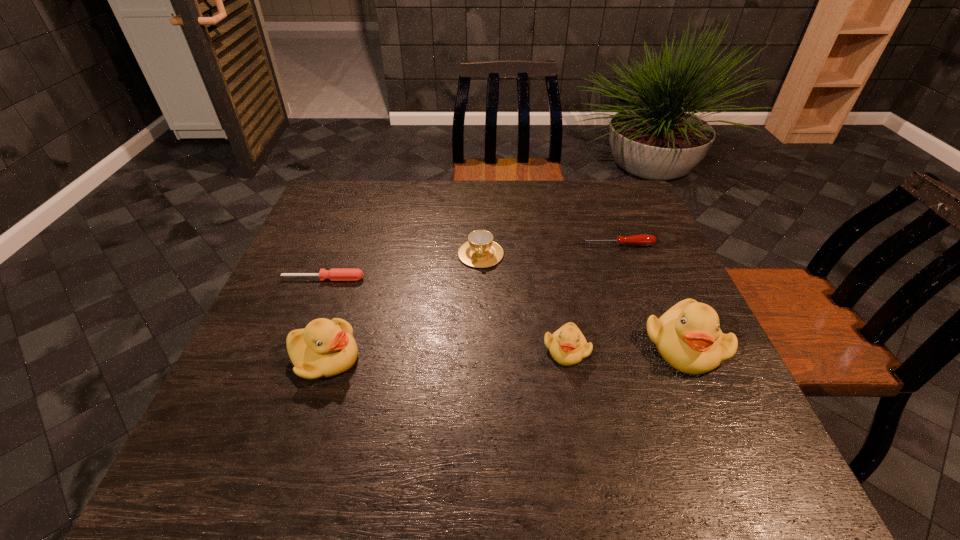
In the image, there is a desktop. Identify the location of vacant space at the far edge. (550, 187).

Locate an element on the screen. free space at the near edge is located at coordinates (549, 398).

Image resolution: width=960 pixels, height=540 pixels. I want to click on vacant space at the right edge, so click(x=650, y=374).

At what (x,y) coordinates should I click in order to perform the action: click on free location at the far left corner of the desktop. Please return your answer as a coordinate pair (x, y). This screenshot has height=540, width=960. Looking at the image, I should click on (367, 197).

The image size is (960, 540). I want to click on vacant space at the near left corner of the desktop, so click(276, 428).

In the image, there is a desktop. Where is `vacant region at the far right corner`? The height and width of the screenshot is (540, 960). vacant region at the far right corner is located at coordinates (586, 187).

Find the location of `free space at the near right corner`. free space at the near right corner is located at coordinates (708, 424).

Where is `empty location between the rightmost duckling and the nearer screwdriver`? empty location between the rightmost duckling and the nearer screwdriver is located at coordinates (504, 312).

Locate an element on the screen. The width and height of the screenshot is (960, 540). free area in between the rightmost duckling and the second duckling from right to left is located at coordinates (625, 347).

Find the location of `free space that is in between the third object from left to right and the left screwdriver`. free space that is in between the third object from left to right and the left screwdriver is located at coordinates pos(402,267).